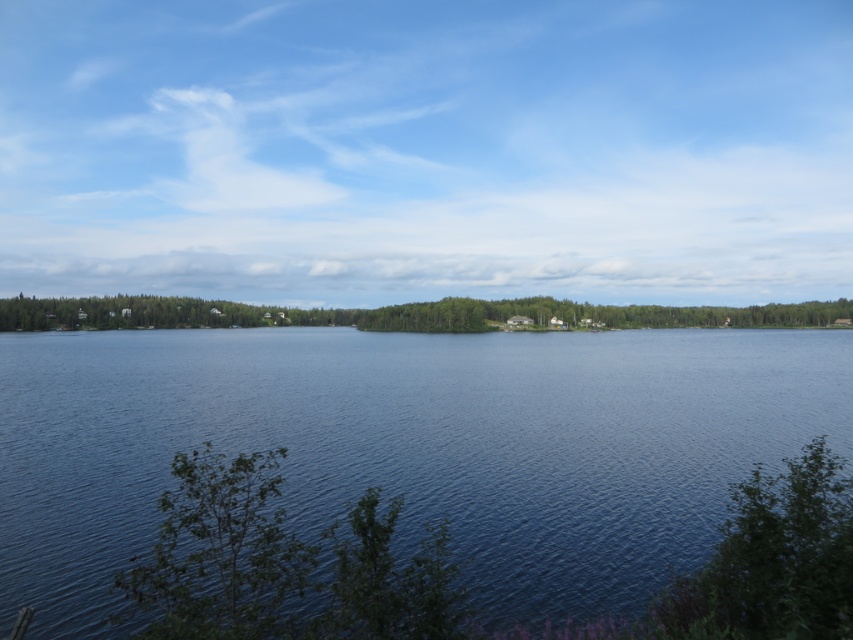
You are standing at the point marked by the coordinates point (772, 561). Looking towards the green leafy bush at lower right, which direction should you walk to reach the nearest house in the middle ground?

The green leafy bush at lower right is located at point (772, 561). Since the nearest house is in the middle ground, you should walk towards the center of the image, away from the lower right position of the bush.